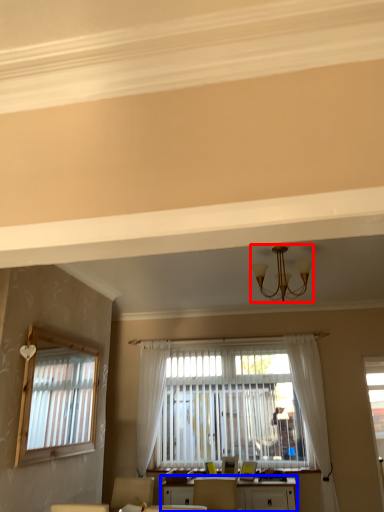
Question: Which object appears farthest to the camera in this image, light fixture (highlighted by a red box) or table (highlighted by a blue box)?

Choices:
 (A) light fixture
 (B) table

Answer: (B)